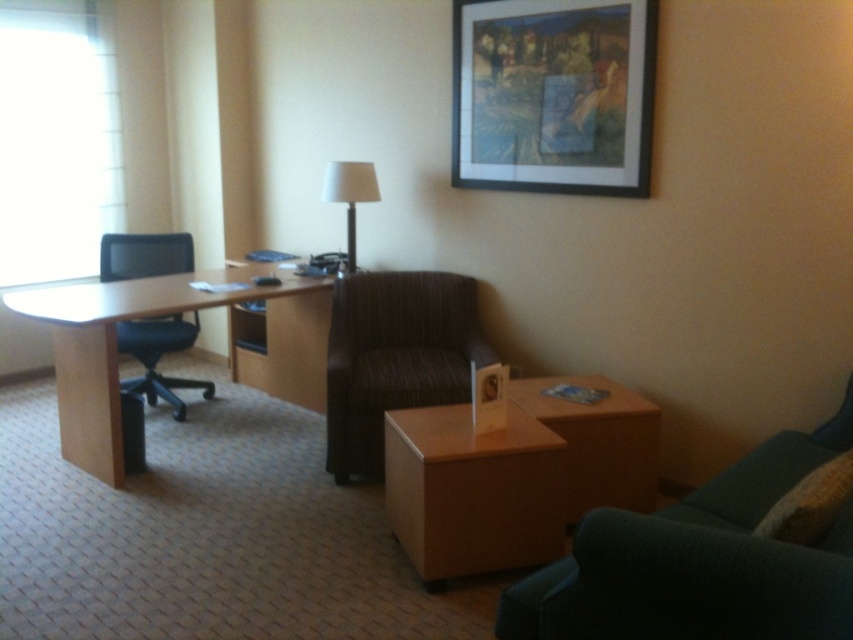
Question: Which is nearer to the brown striped armchair at center?

Choices:
 (A) light brown wood desk at left
 (B) black mesh office chair at left

Answer: (A)

Question: Is green fabric swivel chair at lower right below wooden framed artwork at upper center?

Choices:
 (A) no
 (B) yes

Answer: (B)

Question: Which point appears closest to the camera in this image?

Choices:
 (A) (154, 390)
 (B) (733, 584)

Answer: (B)

Question: Can you confirm if green fabric swivel chair at lower right is bigger than white fabric lampshade at upper center?

Choices:
 (A) no
 (B) yes

Answer: (B)

Question: Is brown striped armchair at center smaller than matte plastic picture frame at center?

Choices:
 (A) no
 (B) yes

Answer: (A)

Question: Which point is closer to the camera taking this photo?

Choices:
 (A) (131, 353)
 (B) (640, 67)
 (C) (326, 408)
 (D) (192, 275)

Answer: (B)